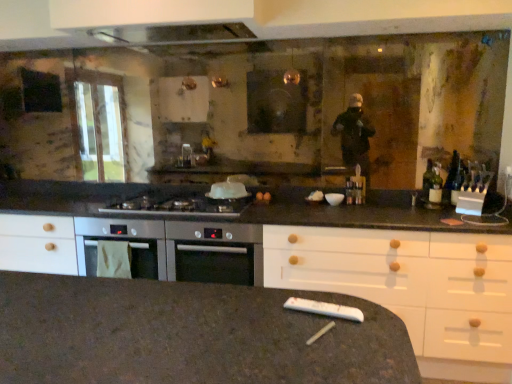
Question: From a real-world perspective, is white plastic remote control at lower center positioned above or below satin silver cooktop at center?

Choices:
 (A) below
 (B) above

Answer: (A)

Question: Relative to satin silver cooktop at center, is white plastic remote control at lower center in front or behind?

Choices:
 (A) behind
 (B) front

Answer: (B)

Question: Considering the positions of white plastic remote control at lower center and satin silver cooktop at center in the image, is white plastic remote control at lower center taller or shorter than satin silver cooktop at center?

Choices:
 (A) short
 (B) tall

Answer: (A)

Question: From the image's perspective, relative to white plastic remote control at lower center, is satin silver cooktop at center above or below?

Choices:
 (A) above
 (B) below

Answer: (A)

Question: Looking at their shapes, would you say satin silver cooktop at center is wider or thinner than white plastic remote control at lower center?

Choices:
 (A) wide
 (B) thin

Answer: (A)

Question: Which is correct: satin silver cooktop at center is inside white plastic remote control at lower center, or outside of it?

Choices:
 (A) inside
 (B) outside

Answer: (B)

Question: From their relative heights in the image, would you say satin silver cooktop at center is taller or shorter than white plastic remote control at lower center?

Choices:
 (A) short
 (B) tall

Answer: (B)